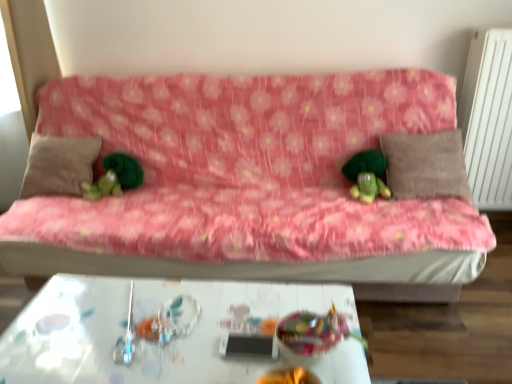
Question: Is green plush toy at left, the second toy when ordered from bottom to top, positioned before brown fabric pillow at right, placed as the 1th pillow when sorted from right to left?

Choices:
 (A) no
 (B) yes

Answer: (A)

Question: Can we say green plush toy at left, placed as the first toy when sorted from top to bottom, lies outside brown fabric pillow at right, which appears as the 2th pillow when viewed from the left?

Choices:
 (A) no
 (B) yes

Answer: (B)

Question: From a real-world perspective, is green plush toy at left, the 2th toy from the right, physically above brown fabric pillow at right, which appears as the 2th pillow when viewed from the left?

Choices:
 (A) no
 (B) yes

Answer: (A)

Question: Can you confirm if green plush toy at left, which is the first toy in left-to-right order, is taller than brown fabric pillow at right, placed as the 1th pillow when sorted from right to left?

Choices:
 (A) yes
 (B) no

Answer: (B)

Question: Does green plush toy at left, placed as the first toy when sorted from top to bottom, appear on the left side of brown fabric pillow at right, which appears as the 2th pillow when viewed from the left?

Choices:
 (A) yes
 (B) no

Answer: (A)

Question: From a real-world perspective, is green plush toy at left, the second toy when ordered from bottom to top, above or below brown fabric pillow at right, which appears as the 2th pillow when viewed from the left?

Choices:
 (A) below
 (B) above

Answer: (A)

Question: Visually, is green plush toy at left, which is the first toy in left-to-right order, positioned to the left or to the right of brown fabric pillow at right, which appears as the 2th pillow when viewed from the left?

Choices:
 (A) right
 (B) left

Answer: (B)

Question: In terms of size, does green plush toy at left, positioned as the 1th toy in back-to-front order, appear bigger or smaller than brown fabric pillow at right, which appears as the 2th pillow when viewed from the left?

Choices:
 (A) big
 (B) small

Answer: (B)

Question: Considering the positions of point (98, 195) and point (409, 185), is point (98, 195) closer or farther from the camera than point (409, 185)?

Choices:
 (A) farther
 (B) closer

Answer: (A)

Question: In the image, is green plush toy at center positioned in front of or behind white glossy table at center?

Choices:
 (A) behind
 (B) front

Answer: (A)

Question: Considering the positions of green plush toy at center and white glossy table at center in the image, is green plush toy at center bigger or smaller than white glossy table at center?

Choices:
 (A) small
 (B) big

Answer: (A)

Question: Looking at their shapes, would you say green plush toy at center is wider or thinner than white glossy table at center?

Choices:
 (A) thin
 (B) wide

Answer: (A)

Question: Based on their positions, is green plush toy at center located to the left or right of white glossy table at center?

Choices:
 (A) right
 (B) left

Answer: (A)

Question: Considering the positions of translucent plastic bowl at center, positioned as the 2th toy in left-to-right order, and white textured radiator at right in the image, is translucent plastic bowl at center, positioned as the 2th toy in left-to-right order, wider or thinner than white textured radiator at right?

Choices:
 (A) thin
 (B) wide

Answer: (A)

Question: From a real-world perspective, is translucent plastic bowl at center, the 1th toy when ordered from front to back, positioned above or below white textured radiator at right?

Choices:
 (A) above
 (B) below

Answer: (B)